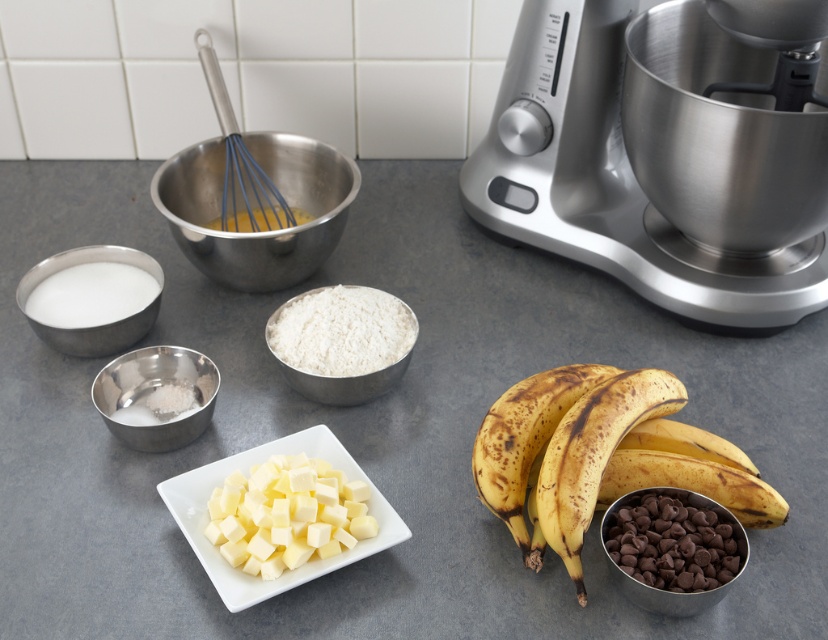
Who is higher up, brown spotted bananas at lower right or metal whisk at center?

metal whisk at center

From the picture: Between brown spotted bananas at lower right and metal whisk at center, which one is positioned lower?

Positioned lower is brown spotted bananas at lower right.

Does point (535, 422) come in front of point (218, 228)?

Yes, point (535, 422) is in front of point (218, 228).

Locate an element on the screen. brown spotted bananas at lower right is located at coordinates (600, 456).

Who is shorter, brown matte bananas at center right or silver metallic bowl at center left?

silver metallic bowl at center left is shorter.

The image size is (828, 640). What are the coordinates of `brown matte bananas at center right` in the screenshot? It's located at pos(593,454).

Is white creamy butter at center to the left of white powder at center from the viewer's perspective?

Yes, white creamy butter at center is to the left of white powder at center.

Does white creamy butter at center have a lesser width compared to white powder at center?

Correct, white creamy butter at center's width is less than white powder at center's.

I want to click on white creamy butter at center, so click(287, 515).